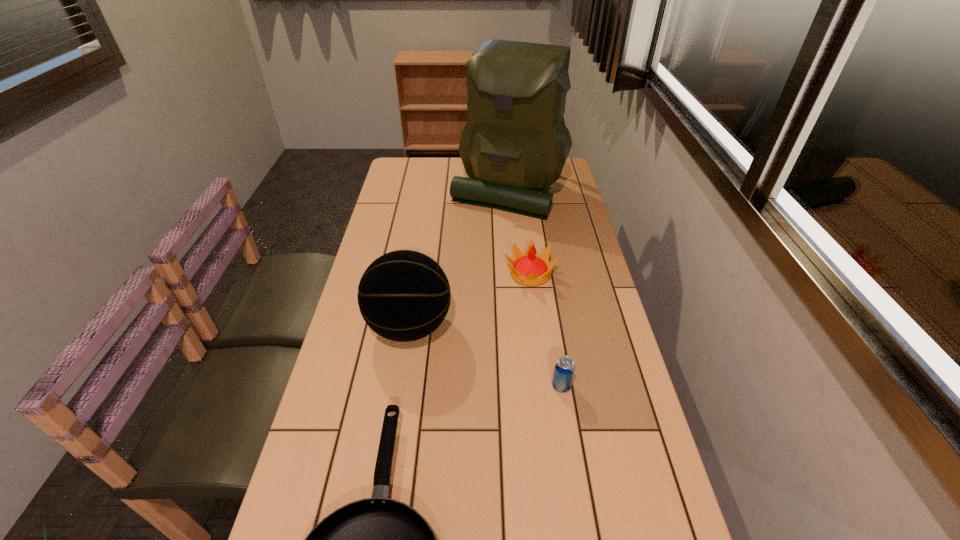
Image resolution: width=960 pixels, height=540 pixels. Find the location of `vacant space located 0.180m on the front of the third shortest object`. vacant space located 0.180m on the front of the third shortest object is located at coordinates (x=539, y=338).

I want to click on blank area located 0.190m on the left of the fourth farthest object, so click(474, 386).

Where is `object situated at the far edge`? This screenshot has height=540, width=960. object situated at the far edge is located at coordinates (514, 145).

Locate an element on the screen. This screenshot has width=960, height=540. object present at the left edge is located at coordinates (404, 295).

Locate an element on the screen. backpack located in the right edge section of the desktop is located at coordinates (514, 145).

The width and height of the screenshot is (960, 540). Find the location of `crown at the right edge`. crown at the right edge is located at coordinates pos(529,269).

The height and width of the screenshot is (540, 960). I want to click on beer can located at the right edge, so click(564, 369).

Find the location of a particular element. This screenshot has width=960, height=540. object present at the far right corner is located at coordinates (514, 145).

This screenshot has height=540, width=960. Find the location of `vacant area at the far edge of the desktop`. vacant area at the far edge of the desktop is located at coordinates (456, 161).

Find the location of a particular element. This screenshot has width=960, height=540. vacant area at the left edge is located at coordinates (359, 339).